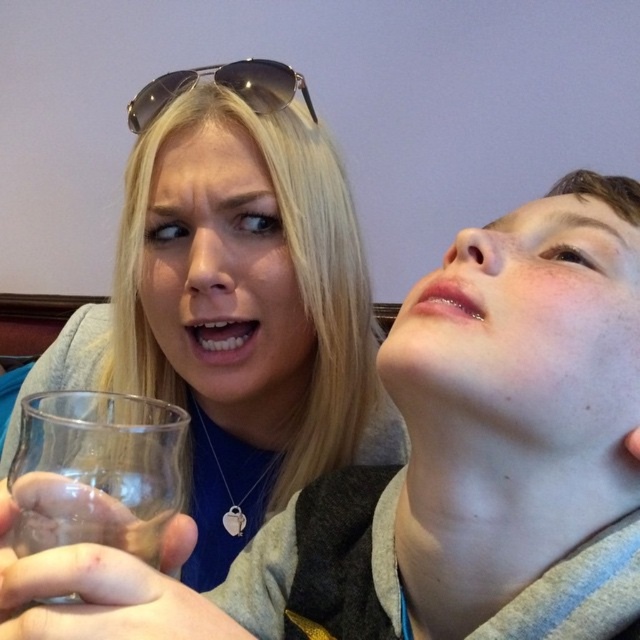
Looking at this image, does clear glass at left appear on the right side of metallic aviator sunglasses at upper center?

Indeed, clear glass at left is positioned on the right side of metallic aviator sunglasses at upper center.

Does clear glass at left appear over metallic aviator sunglasses at upper center?

Incorrect, clear glass at left is not positioned above metallic aviator sunglasses at upper center.

Image resolution: width=640 pixels, height=640 pixels. In order to click on clear glass at left in this screenshot , I will do `click(237, 305)`.

Does transparent glass at lower left appear over metallic aviator sunglasses at upper center?

Actually, transparent glass at lower left is below metallic aviator sunglasses at upper center.

Is the position of transparent glass at lower left less distant than that of metallic aviator sunglasses at upper center?

Yes.

The height and width of the screenshot is (640, 640). Identify the location of transparent glass at lower left. (96, 472).

Is clear glass at left bigger than transparent glass at lower left?

Yes, clear glass at left is bigger than transparent glass at lower left.

Looking at this image, which is more to the left, clear glass at left or transparent glass at lower left?

clear glass at left is more to the left.

Describe the element at coordinates (237, 305) in the screenshot. I see `clear glass at left` at that location.

Identify the location of clear glass at left. (237, 305).